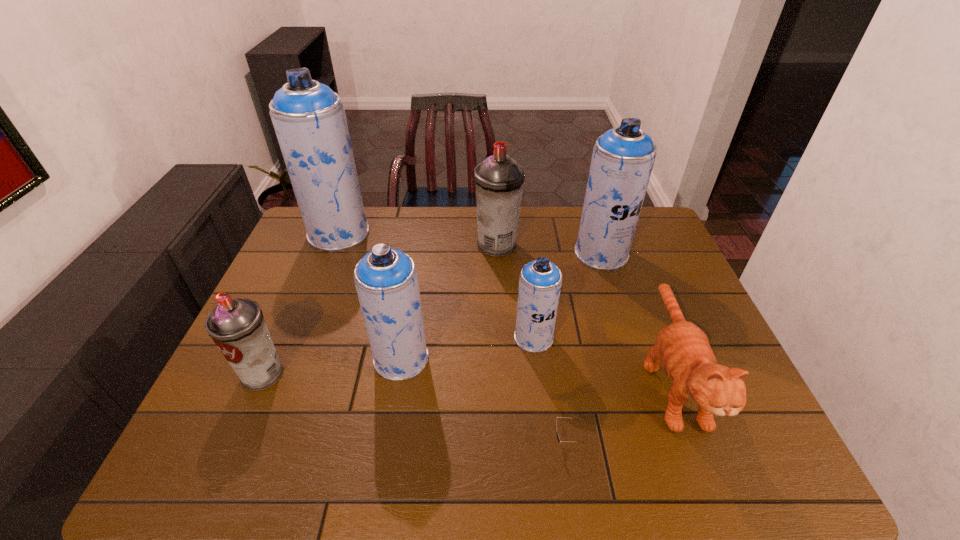
Locate an element on the screen. vacant space positioned on the front of the left gray aerosol can is located at coordinates (241, 424).

Where is `blank space located 0.100m in front of the lenses of the black sunglasses`? The width and height of the screenshot is (960, 540). blank space located 0.100m in front of the lenses of the black sunglasses is located at coordinates (507, 441).

The width and height of the screenshot is (960, 540). In order to click on free space located 0.210m in front of the lenses of the black sunglasses in this screenshot , I will do `click(457, 441)`.

Identify the location of free region located 0.330m in front of the lenses of the black sunglasses. tap(402, 441).

At what (x,y) coordinates should I click in order to perform the action: click on cat present at the near edge. Please return your answer as a coordinate pair (x, y). Image resolution: width=960 pixels, height=540 pixels. Looking at the image, I should click on (683, 349).

Locate an element on the screen. sunglasses that is at the near edge is located at coordinates (558, 438).

In order to click on aerosol can located in the right edge section of the desktop in this screenshot , I will do `click(623, 157)`.

This screenshot has height=540, width=960. Identify the location of cat that is at the right edge. (683, 349).

You are a GUI agent. You are given a task and a screenshot of the screen. Output one action in this format:
    pyautogui.click(x=<x>, y=<y>)
    Task: Click on the object located in the far left corner section of the desktop
    
    Given the screenshot: What is the action you would take?
    pyautogui.click(x=309, y=119)

Find the location of a particular element. This screenshot has height=540, width=960. object located in the far right corner section of the desktop is located at coordinates (623, 157).